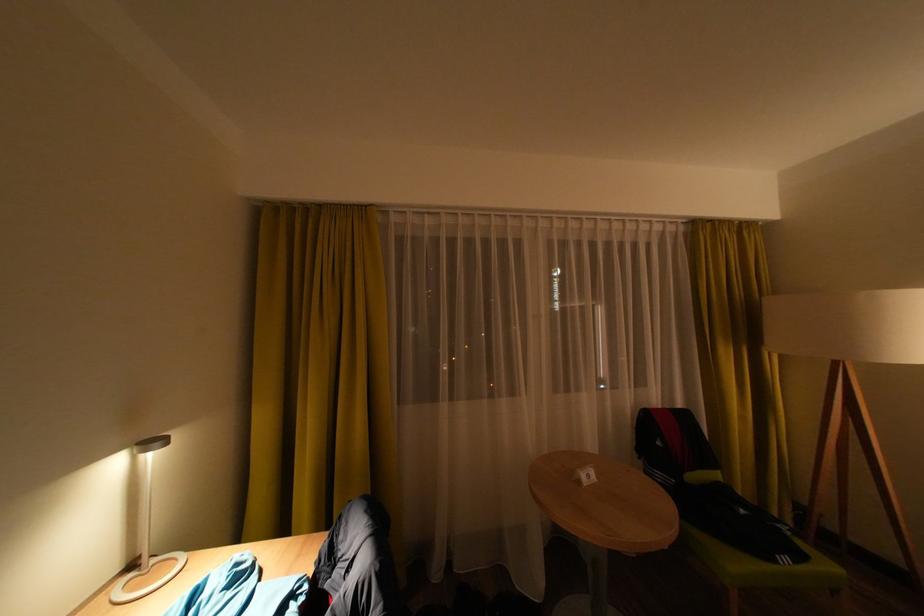
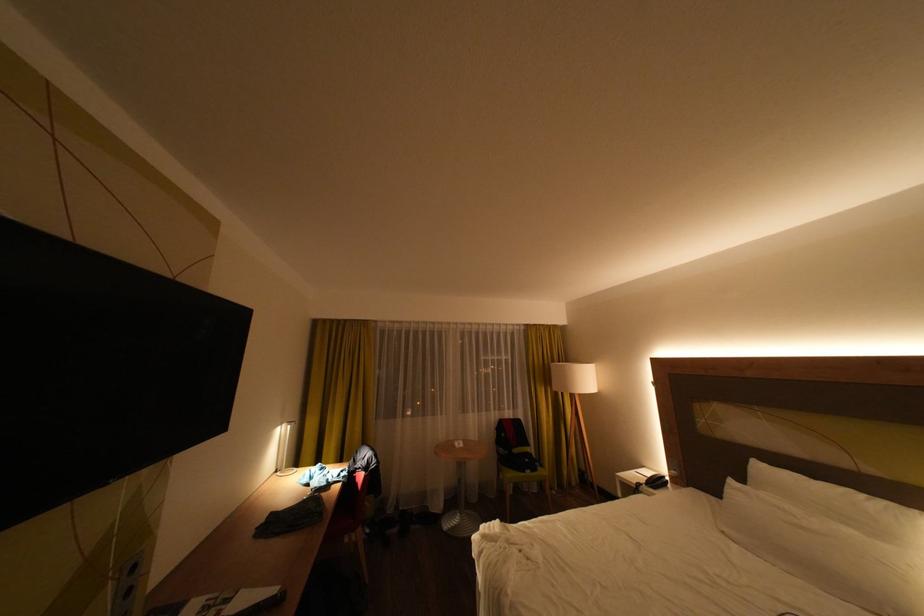
Where in the second image is the point corresponding to the point at 752,512 from the first image?

(538, 460)